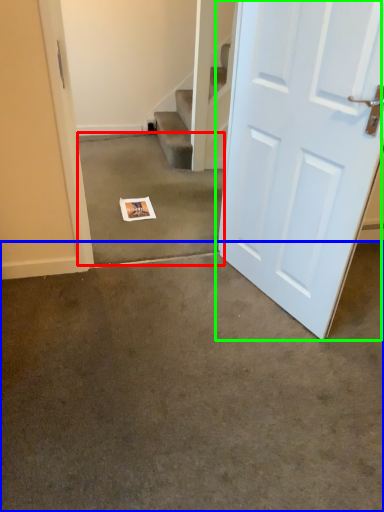
Question: Which is nearer to the concrete (highlighted by a red box)? concrete (highlighted by a blue box) or door (highlighted by a green box).

Choices:
 (A) concrete
 (B) door

Answer: (B)